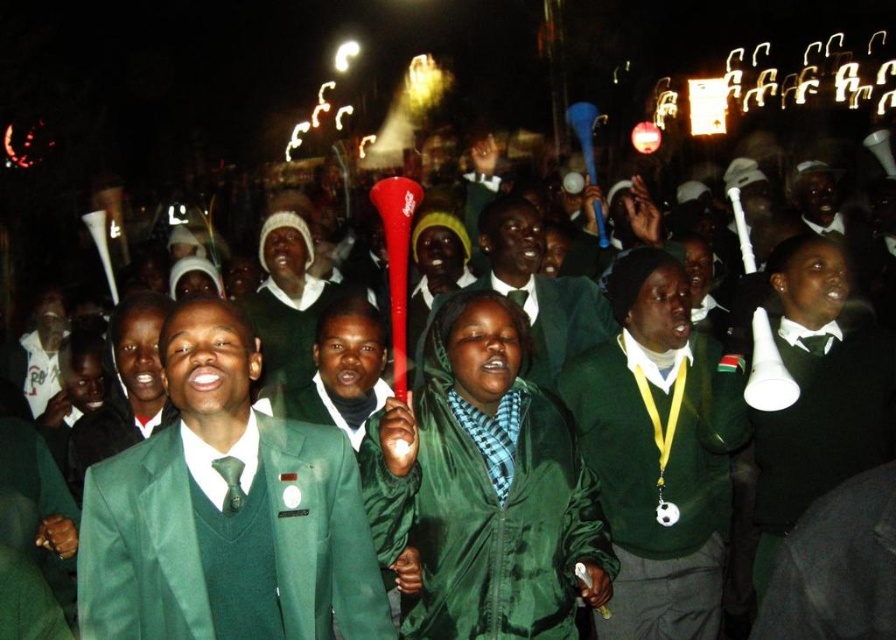
You are standing in the crowd at this nighttime event and want to locate the green fabric megaphone at center and the green wool sweater at center. Which object is positioned to the right of the other?

The green fabric megaphone at center is to the right of the green wool sweater at center.

You are a photographer at the event and want to capture a photo that includes both the green fabric jacket at center and the green wool sweater at center. Which one should you focus on first if you want to include both in the frame without moving the camera?

The green fabric jacket at center is to the right of the green wool sweater at center, so you should focus on the green wool sweater at center first to ensure both are in the frame without moving the camera.